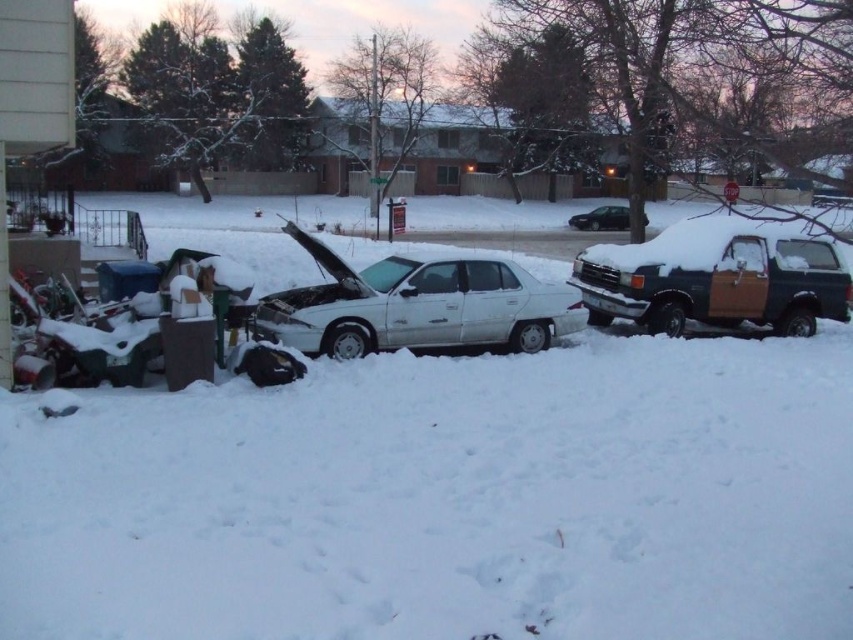
Which is more to the left, dark blue wood panel truck at right or black matte sedan at center?

From the viewer's perspective, dark blue wood panel truck at right appears more on the left side.

Is dark blue wood panel truck at right taller than black matte sedan at center?

Incorrect, dark blue wood panel truck at right's height is not larger of black matte sedan at center's.

Does point (827, 256) come in front of point (616, 214)?

Yes, point (827, 256) is closer to viewer.

This screenshot has width=853, height=640. What are the coordinates of `dark blue wood panel truck at right` in the screenshot? It's located at (715, 278).

Does white matte sedan at center appear over black matte sedan at center?

Actually, white matte sedan at center is below black matte sedan at center.

Find the location of a particular element. The width and height of the screenshot is (853, 640). white matte sedan at center is located at coordinates (416, 305).

Is point (453, 336) farther from camera compared to point (628, 220)?

No.

You are a GUI agent. You are given a task and a screenshot of the screen. Output one action in this format:
    pyautogui.click(x=<x>, y=<y>)
    Task: Click on the white matte sedan at center
    The height and width of the screenshot is (640, 853).
    Given the screenshot: What is the action you would take?
    pyautogui.click(x=416, y=305)

Can you confirm if white matte sedan at center is positioned above dark blue wood panel truck at right?

Yes.

Find the location of a particular element. white matte sedan at center is located at coordinates (416, 305).

At what (x,y) coordinates should I click in order to perform the action: click on white matte sedan at center. Please return your answer as a coordinate pair (x, y). The width and height of the screenshot is (853, 640). Looking at the image, I should click on (416, 305).